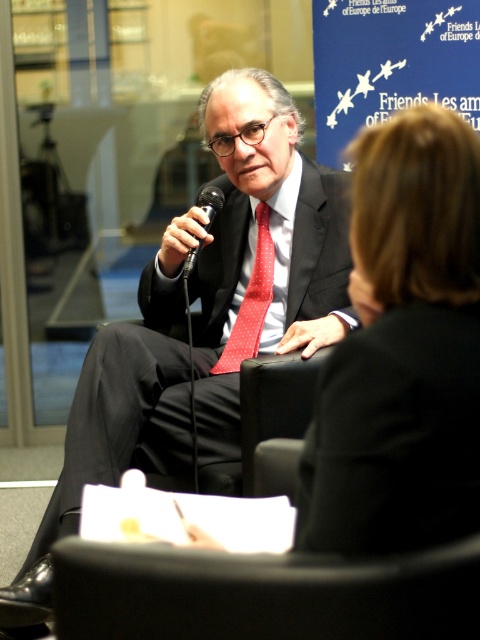
Between point (187, 557) and point (259, 342), which one is positioned in front?

Point (187, 557)

Does black leather chair at lower center appear on the right side of red dotted fabric tie at center?

Yes, black leather chair at lower center is to the right of red dotted fabric tie at center.

What do you see at coordinates (264, 593) in the screenshot?
I see `black leather chair at lower center` at bounding box center [264, 593].

This screenshot has height=640, width=480. Identify the location of black leather chair at lower center. (264, 593).

Who is shorter, black leather jacket at upper right or black metallic microphone at center?

Standing shorter between the two is black metallic microphone at center.

Is black leather jacket at upper right to the right of black metallic microphone at center from the viewer's perspective?

Indeed, black leather jacket at upper right is positioned on the right side of black metallic microphone at center.

Locate an element on the screen. The width and height of the screenshot is (480, 640). black leather jacket at upper right is located at coordinates (403, 349).

Locate an element on the screen. The image size is (480, 640). black leather jacket at upper right is located at coordinates (403, 349).

What do you see at coordinates (205, 316) in the screenshot?
I see `matte black suit at center` at bounding box center [205, 316].

Is point (290, 273) closer to camera compared to point (62, 579)?

No, it is behind (62, 579).

Locate an element on the screen. This screenshot has width=480, height=640. matte black suit at center is located at coordinates (205, 316).